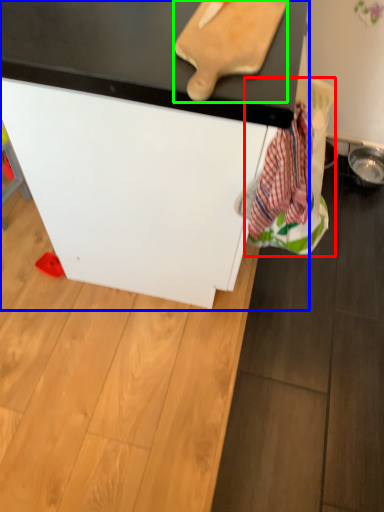
Question: Which object is positioned closest to laundry (highlighted by a red box)? Select from furniture (highlighted by a blue box) and cutting board (highlighted by a green box).

Choices:
 (A) furniture
 (B) cutting board

Answer: (A)